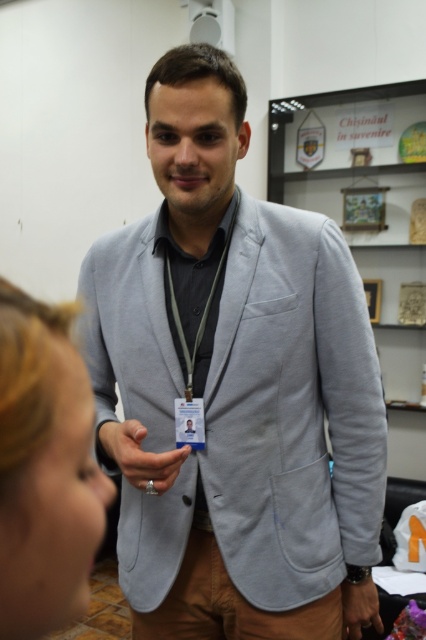
Is point (189, 380) more distant than point (357, 627)?

That is False.

Who is higher up, green fabric lanyard at center or matte silver ring at lower center?

green fabric lanyard at center

Which is behind, point (218, 264) or point (347, 611)?

Positioned behind is point (347, 611).

You are a GUI agent. You are given a task and a screenshot of the screen. Output one action in this format:
    pyautogui.click(x=<x>, y=<y>)
    Task: Click on the green fabric lanyard at center
    
    Given the screenshot: What is the action you would take?
    pyautogui.click(x=204, y=307)

Between silver metallic ring at center and matte silver ring at lower center, which one has more height?

matte silver ring at lower center is taller.

Can you confirm if silver metallic ring at center is smaller than matte silver ring at lower center?

No.

Between point (164, 483) and point (362, 608), which one is positioned behind?

The point (362, 608) is more distant.

Image resolution: width=426 pixels, height=640 pixels. In order to click on silver metallic ring at center in this screenshot , I will do `click(140, 456)`.

Does light gray cotton blazer at center have a greater height compared to green fabric lanyard at center?

Indeed, light gray cotton blazer at center has a greater height compared to green fabric lanyard at center.

Image resolution: width=426 pixels, height=640 pixels. Describe the element at coordinates (235, 384) in the screenshot. I see `light gray cotton blazer at center` at that location.

Locate an element on the screen. light gray cotton blazer at center is located at coordinates (235, 384).